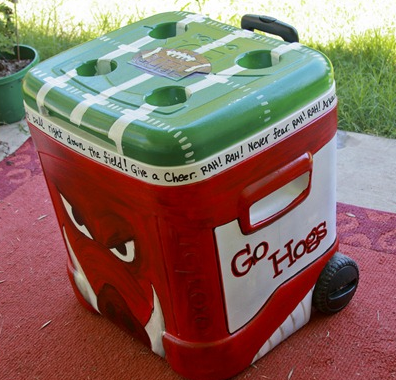
What are the coordinates of `handle` in the screenshot? It's located at (272, 21).